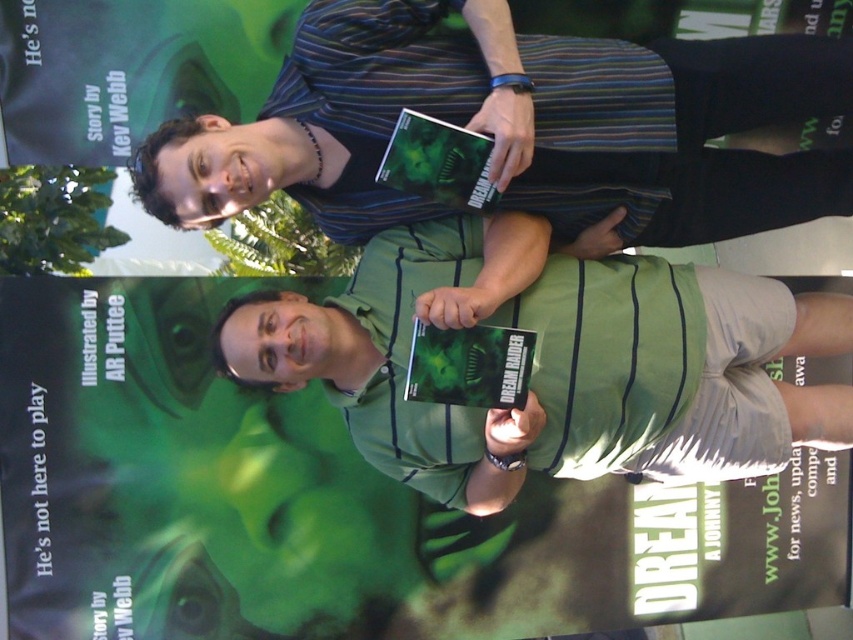
Question: Does green striped shirt at upper center appear under green striped shirt at center?

Choices:
 (A) no
 (B) yes

Answer: (A)

Question: Which point is farther to the camera?

Choices:
 (A) green striped shirt at center
 (B) green striped shirt at upper center

Answer: (A)

Question: Which of the following is the farthest from the observer?

Choices:
 (A) green striped shirt at center
 (B) green striped shirt at upper center

Answer: (A)

Question: Is green striped shirt at upper center below green striped shirt at center?

Choices:
 (A) no
 (B) yes

Answer: (A)

Question: Considering the relative positions of green striped shirt at upper center and green striped shirt at center in the image provided, where is green striped shirt at upper center located with respect to green striped shirt at center?

Choices:
 (A) below
 (B) above

Answer: (B)

Question: Which object is farther from the camera taking this photo?

Choices:
 (A) green striped shirt at upper center
 (B) green striped shirt at center

Answer: (B)